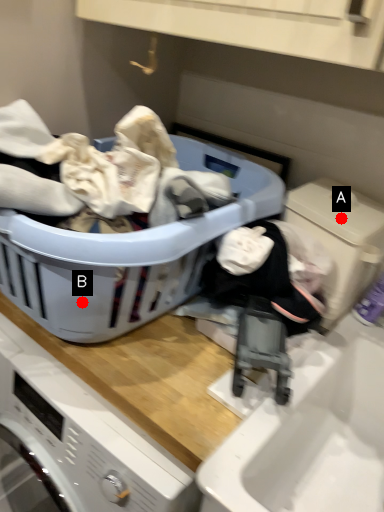
Question: Two points are circled on the image, labeled by A and B beside each circle. Which point is farther from the camera taking this photo?

Choices:
 (A) A is further
 (B) B is further

Answer: (A)